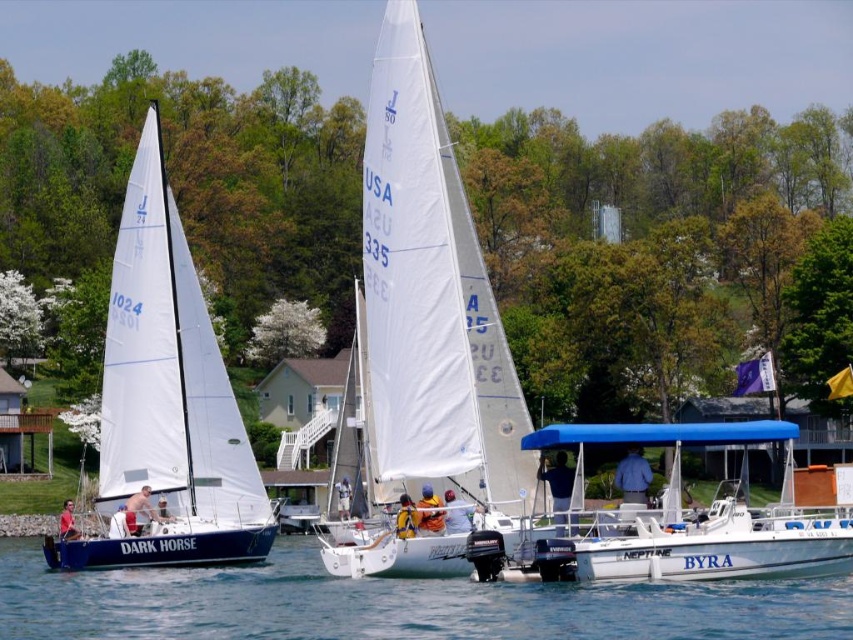
You are a photographer on a boat trying to capture the white matte motorboat at lower right and the transparent blue water at center. Which object is closer to the camera lens?

The white matte motorboat at lower right is closer to the camera lens because the transparent blue water at center is positioned under it, indicating it is further away.

You are a photographer standing on the deck of the motorboat observing the two sailboats. You want to take a photo of the point at coordinates point (57,577) and point (646,563). Which point is closer to your camera?

Point (57,577) is further to the camera than point (646,563), so the point closer to your camera is point (646,563).

You are a photographer on a boat trying to capture a photo of the white sailboat at left. The white matte motorboat at lower right is obstructing your view. Can you move forward to get a clear shot without the motorboat in the frame?

The white matte motorboat at lower right is behind the white sailboat at left, so moving forward would bring the sailboat closer while keeping the motorboat behind it. This should allow you to take a clear photo without the motorboat obstructing the view.